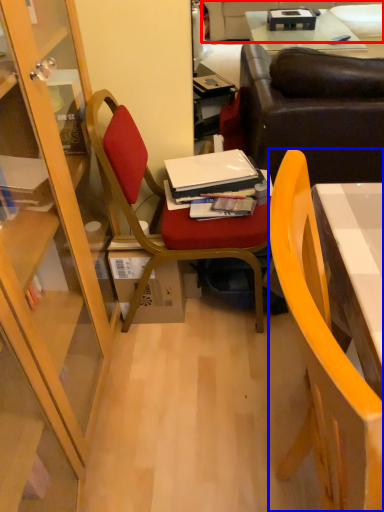
Question: Which object appears farthest to the camera in this image, couch (highlighted by a red box) or chair (highlighted by a blue box)?

Choices:
 (A) couch
 (B) chair

Answer: (A)